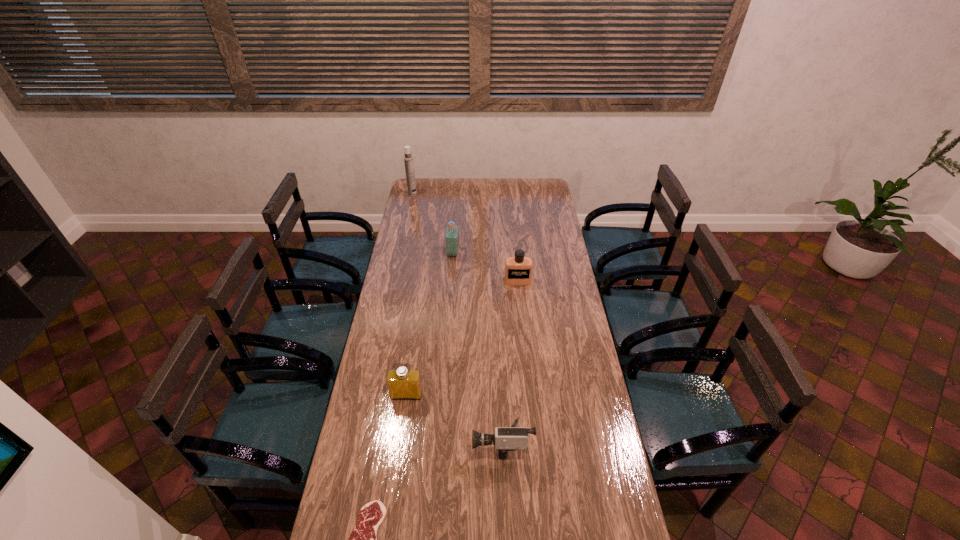
At what (x,y) coordinates should I click in order to perform the action: click on vacant space at the far edge of the desktop. Please return your answer as a coordinate pair (x, y). Looking at the image, I should click on (455, 186).

Image resolution: width=960 pixels, height=540 pixels. I want to click on vacant area at the left edge, so click(x=393, y=312).

This screenshot has width=960, height=540. In order to click on vacant region at the right edge of the desktop in this screenshot , I will do `click(538, 232)`.

Where is `vacant space at the far left corner`? The width and height of the screenshot is (960, 540). vacant space at the far left corner is located at coordinates (422, 179).

This screenshot has width=960, height=540. What are the coordinates of `free space at the far right corner of the desktop` in the screenshot? It's located at (545, 197).

I want to click on vacant space that is in between the nearest perfume and the third farthest object, so click(462, 338).

The image size is (960, 540). I want to click on vacant space that's between the second perfume from left to right and the leftmost object, so click(433, 224).

Where is `free space between the camcorder and the second farthest object`? The image size is (960, 540). free space between the camcorder and the second farthest object is located at coordinates (477, 348).

You are a GUI agent. You are given a task and a screenshot of the screen. Output one action in this format:
    pyautogui.click(x=<x>, y=<y>)
    Task: Click on the blank region between the nearest perfume and the farthest object
    This screenshot has width=960, height=540.
    Given the screenshot: What is the action you would take?
    pyautogui.click(x=410, y=295)

The height and width of the screenshot is (540, 960). Identify the location of free space that is in between the rightmost perfume and the nearest perfume. (462, 338).